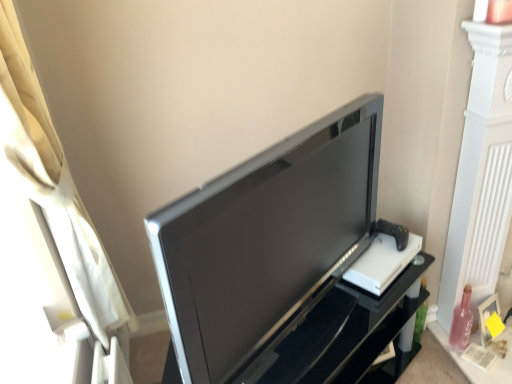
Question: Is pink glass bottle at lower right next to satin black television at center and touching it?

Choices:
 (A) no
 (B) yes

Answer: (A)

Question: Considering the relative positions of pink glass bottle at lower right and satin black television at center in the image provided, is pink glass bottle at lower right to the right of satin black television at center from the viewer's perspective?

Choices:
 (A) no
 (B) yes

Answer: (B)

Question: Is pink glass bottle at lower right outside satin black television at center?

Choices:
 (A) yes
 (B) no

Answer: (A)

Question: From a real-world perspective, is pink glass bottle at lower right on satin black television at center?

Choices:
 (A) no
 (B) yes

Answer: (A)

Question: From the image's perspective, is pink glass bottle at lower right below satin black television at center?

Choices:
 (A) no
 (B) yes

Answer: (B)

Question: From the image's perspective, is satin black tv at center positioned above or below satin black television at center?

Choices:
 (A) below
 (B) above

Answer: (A)

Question: Choose the correct answer: Is satin black tv at center inside satin black television at center or outside it?

Choices:
 (A) outside
 (B) inside

Answer: (A)

Question: Considering the positions of satin black tv at center and satin black television at center in the image, is satin black tv at center wider or thinner than satin black television at center?

Choices:
 (A) thin
 (B) wide

Answer: (B)

Question: From their relative heights in the image, would you say satin black tv at center is taller or shorter than satin black television at center?

Choices:
 (A) tall
 (B) short

Answer: (B)

Question: From the image's perspective, is satin black tv at center positioned above or below white fabric curtain at left?

Choices:
 (A) above
 (B) below

Answer: (B)

Question: Does point (269, 367) appear closer or farther from the camera than point (20, 200)?

Choices:
 (A) farther
 (B) closer

Answer: (A)

Question: In terms of size, does satin black tv at center appear bigger or smaller than white fabric curtain at left?

Choices:
 (A) big
 (B) small

Answer: (A)

Question: Would you say satin black tv at center is to the left or to the right of white fabric curtain at left in the picture?

Choices:
 (A) left
 (B) right

Answer: (B)

Question: In terms of height, does satin black tv at center look taller or shorter compared to pink glass bottle at lower right?

Choices:
 (A) tall
 (B) short

Answer: (A)

Question: In terms of width, does satin black tv at center look wider or thinner when compared to pink glass bottle at lower right?

Choices:
 (A) thin
 (B) wide

Answer: (B)